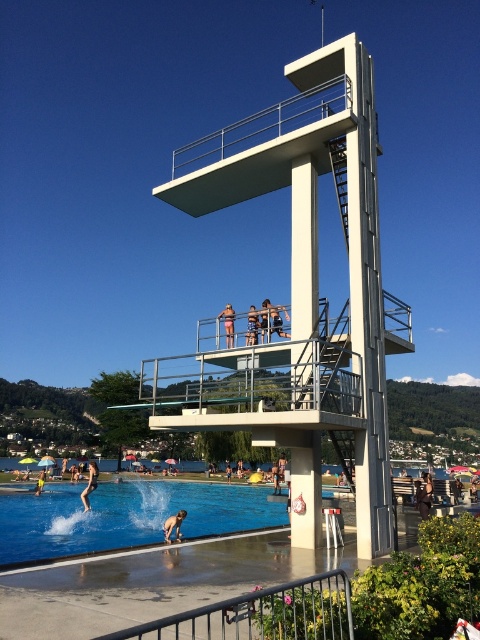
Which is in front, point (277, 310) or point (230, 474)?

Point (277, 310)

Between blue denim shorts at upper center and smooth skin person at center, which one appears on the left side from the viewer's perspective?

smooth skin person at center is more to the left.

Is point (268, 316) more distant than point (228, 470)?

No, it is not.

Where is `blue denim shorts at upper center`? blue denim shorts at upper center is located at coordinates [273, 317].

Is white concrete observation tower at upper center positioned before blue glossy water at lower left?

Yes, white concrete observation tower at upper center is in front of blue glossy water at lower left.

Which is behind, point (309, 204) or point (37, 536)?

Point (37, 536)

The width and height of the screenshot is (480, 640). What are the coordinates of `white concrete observation tower at upper center` in the screenshot? It's located at (299, 296).

Between smooth skin person at lower right and dark blue swimsuit at lower left, which one has more height?

With more height is dark blue swimsuit at lower left.

Is point (428, 481) closer to viewer compared to point (86, 490)?

That is True.

This screenshot has height=640, width=480. Describe the element at coordinates (424, 497) in the screenshot. I see `smooth skin person at lower right` at that location.

Locate an element on the screen. This screenshot has height=640, width=480. smooth skin person at lower right is located at coordinates (424, 497).